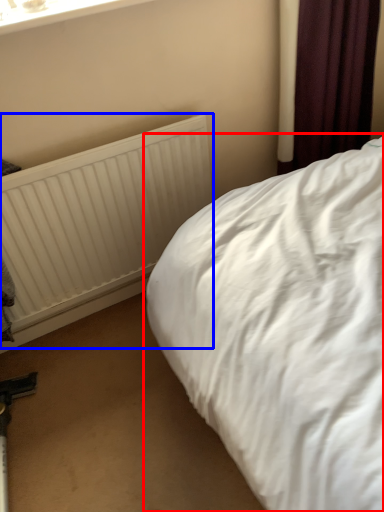
Question: Among these objects, which one is farthest to the camera, bed (highlighted by a red box) or radiator (highlighted by a blue box)?

Choices:
 (A) bed
 (B) radiator

Answer: (B)